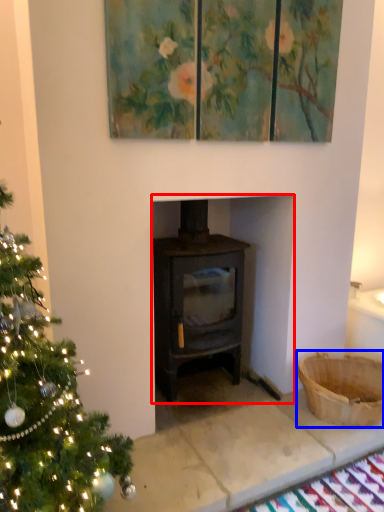
Question: Which object appears farthest to the camera in this image, fireplace (highlighted by a red box) or basket (highlighted by a blue box)?

Choices:
 (A) fireplace
 (B) basket

Answer: (B)